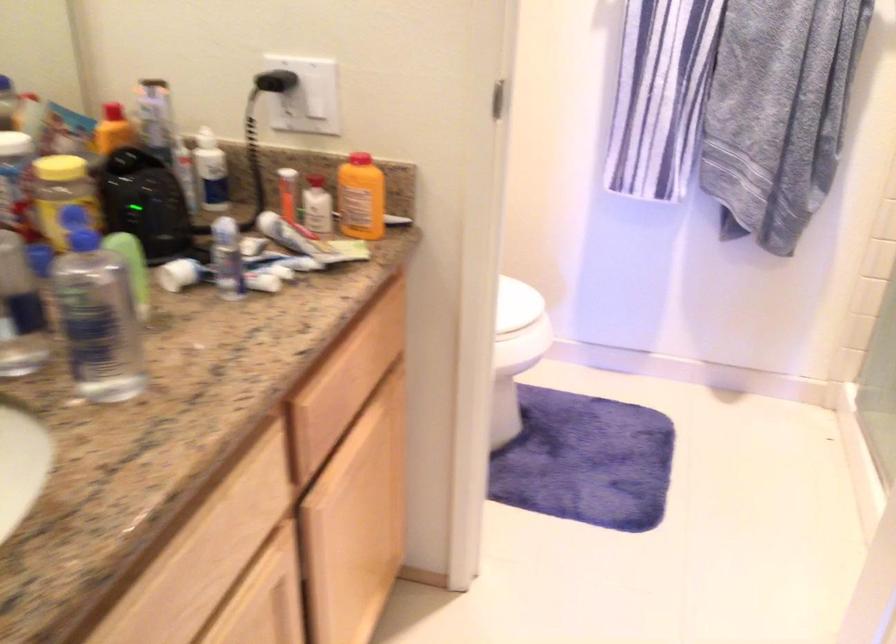
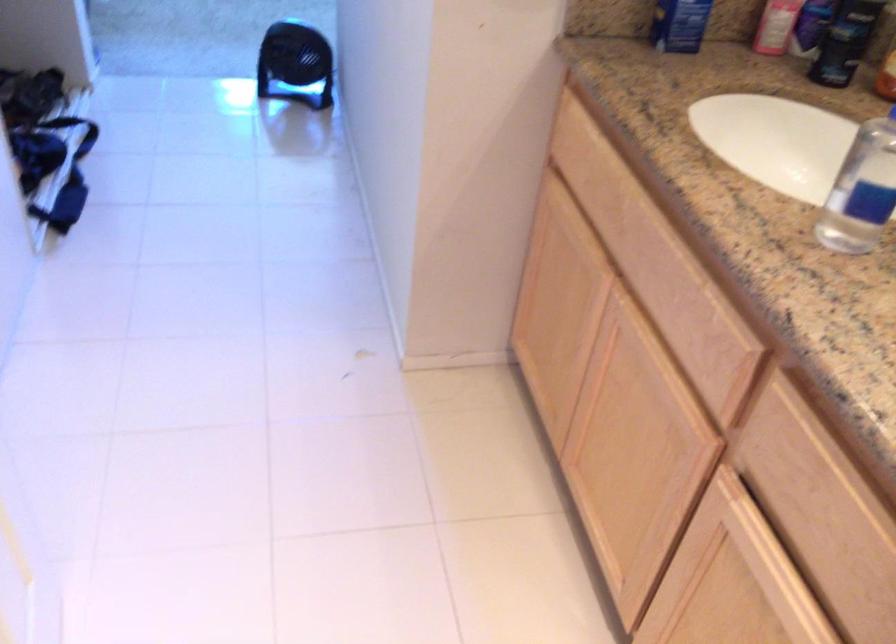
Locate, in the second image, the point that corresponds to (x=277, y=567) in the first image.

(684, 429)